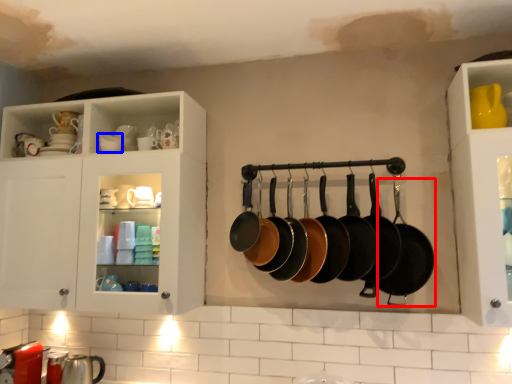
Question: Which object appears farthest to the camera in this image, frying pan (highlighted by a red box) or tableware (highlighted by a blue box)?

Choices:
 (A) frying pan
 (B) tableware

Answer: (B)